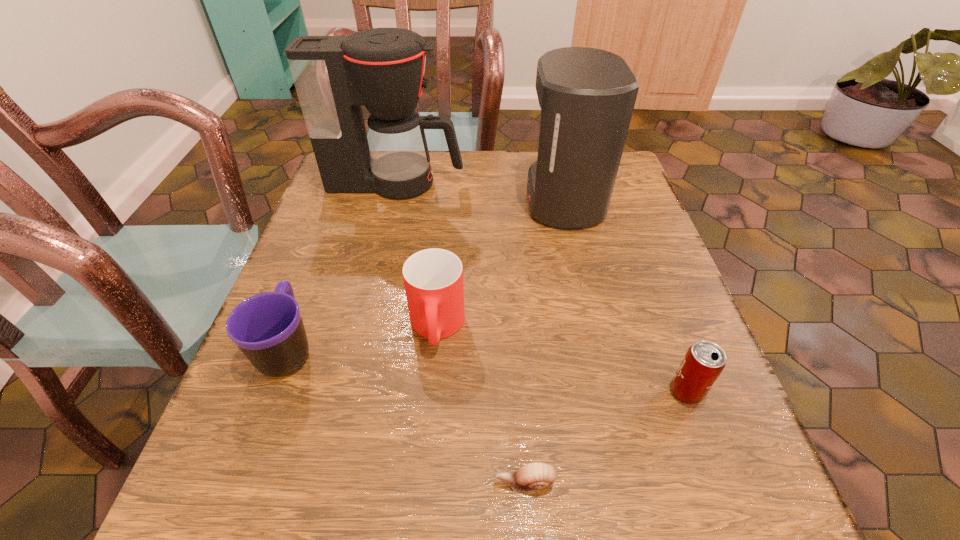
Choose which object is the fourth nearest neighbor to the fifth object from left to right. Please provide its 2D coordinates. Your answer should be formatted as a tuple, i.e. [(x, y)], where the tuple contains the x and y coordinates of a point satisfying the conditions above.

[(267, 327)]

Where is `object that ranks as the third closest to the cup`? The height and width of the screenshot is (540, 960). object that ranks as the third closest to the cup is located at coordinates (587, 96).

At what (x,y) coordinates should I click in order to perform the action: click on blank area in the image that satisfies the following two spatial constraints: 1. on the button side of the second object from right to left; 2. on the side of the cup with the handle. Please return your answer as a coordinate pair (x, y). The height and width of the screenshot is (540, 960). Looking at the image, I should click on (592, 327).